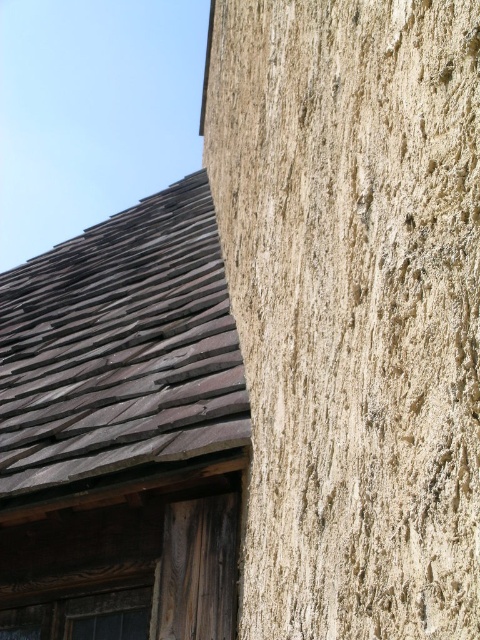
You are an architect assessing the building facade. You need to determine if the dark brown shingles at upper left can cover the wooden textured window at lower left in terms of width. Based on the scene, what would you conclude?

The dark brown shingles at upper left have a larger width than the wooden textured window at lower left, so they can cover the window in terms of width.

You are standing in front of the rustic building and notice the dark brown shingles at upper left and the wooden textured window at lower left. Which object is located higher up on the building?

The dark brown shingles at upper left are positioned over the wooden textured window at lower left, so they are located higher up on the building.